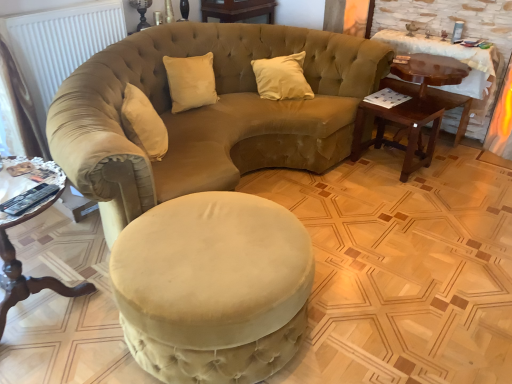
Identify the location of empty space that is ontop of white matte radiator at upper left (from a real-world perspective). Image resolution: width=512 pixels, height=384 pixels. (51, 5).